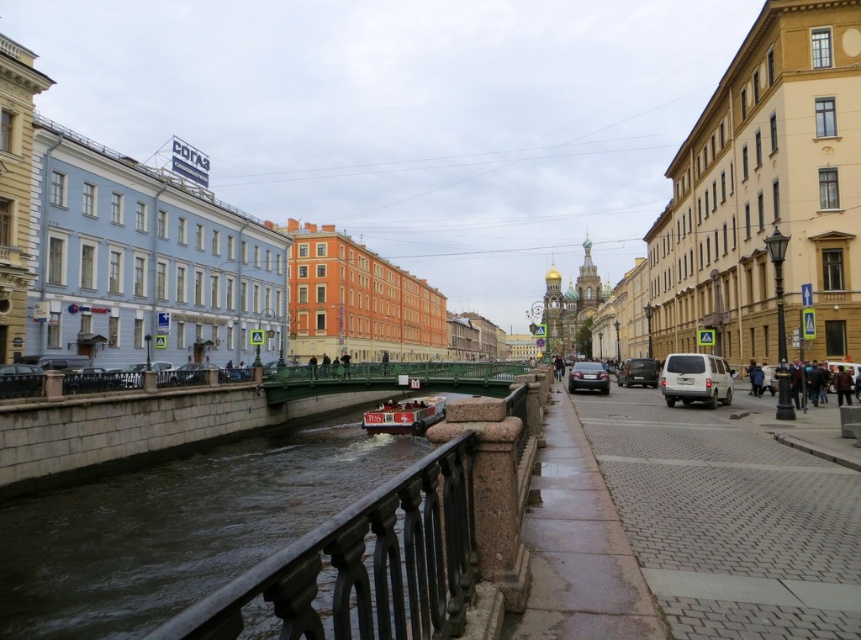
You are a delivery person who needs to park your vehicle in a parking spot that has a height restriction of 1.8 meters. You see the satin black van at center and the dark brown leather jacket at lower right in the scene. Which vehicle is more likely to exceed the height limit?

The satin black van at center is much taller than the dark brown leather jacket at lower right, so it is more likely to exceed the 1.8 meters height restriction.

You are a city planner assessing the canal area for safety. You need to ensure that the black polished metal railing at center and the metallic red boat at center can coexist without obstruction. Given that the railing is wider than the boat, which object would require more space along the canal path?

The black polished metal railing at center requires more space along the canal path because its width is larger than that of the metallic red boat at center.

You are a delivery driver who needs to park your vehicle in a space that can accommodate your 2.5 meter wide truck. You see the satin black car at center and the satin black van at center in the parking area. Which vehicle occupies a parking spot that is wider than your truck?

The satin black car at center has a larger width than the satin black van at center, so the parking spot occupied by the satin black car at center is wider than your truck.